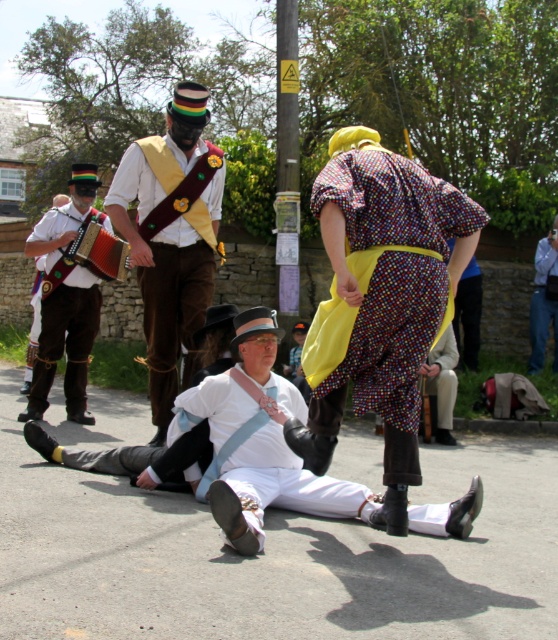
Question: Which point is closer to the camera?

Choices:
 (A) velvet brown vest at center
 (B) wooden accordion at center

Answer: (A)

Question: Which point appears closest to the camera in this image?

Choices:
 (A) (333, 170)
 (B) (220, 387)
 (C) (79, 248)

Answer: (A)

Question: Is white matte pants at center above wooden accordion at center?

Choices:
 (A) no
 (B) yes

Answer: (A)

Question: Can you confirm if blue jeans at lower right is positioned below wooden accordion at center?

Choices:
 (A) no
 (B) yes

Answer: (B)

Question: Is white leather pants at center to the right of blue jeans at lower right from the viewer's perspective?

Choices:
 (A) yes
 (B) no

Answer: (B)

Question: Considering the real-world distances, which object is closest to the white leather pants at center?

Choices:
 (A) blue jeans at lower right
 (B) white matte pants at center
 (C) polka dot fabric dress at upper right
 (D) velvet brown vest at center

Answer: (B)